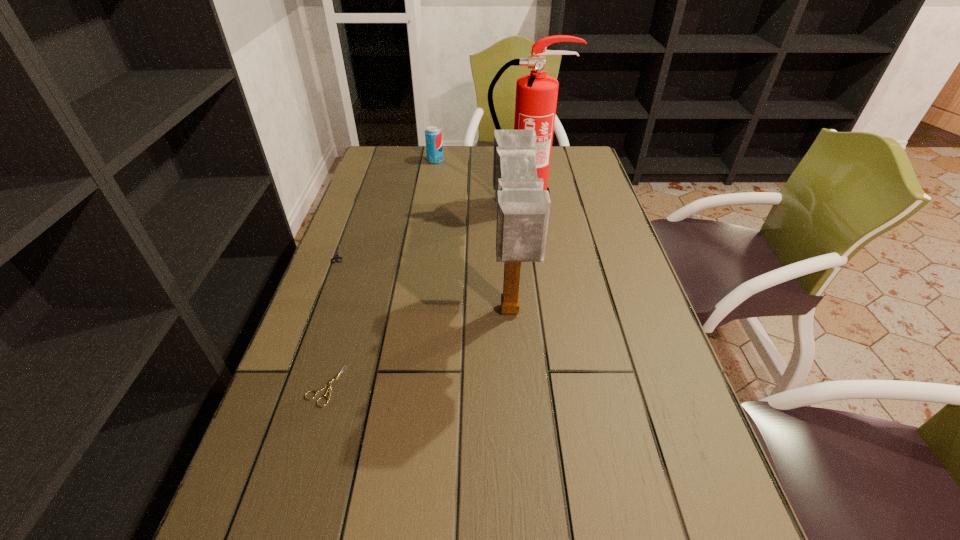
In the image, there is a desktop. Identify the location of vacant space at the far left corner. (375, 165).

In the image, there is a desktop. At what (x,y) coordinates should I click in order to perform the action: click on free region at the far right corner. Please return your answer as a coordinate pair (x, y). This screenshot has height=540, width=960. Looking at the image, I should click on (567, 150).

Identify the location of free space between the third farthest object and the nearer shears. The height and width of the screenshot is (540, 960). (332, 320).

The height and width of the screenshot is (540, 960). Find the location of `empty location between the third tallest object and the nearest object`. empty location between the third tallest object and the nearest object is located at coordinates (380, 273).

Identify the location of free space between the nearer shears and the left shears. The height and width of the screenshot is (540, 960). (332, 320).

Locate an element on the screen. The height and width of the screenshot is (540, 960). free space between the nearer shears and the farther shears is located at coordinates point(332,320).

This screenshot has width=960, height=540. In order to click on vacant space in between the second tallest object and the third nearest object in this screenshot , I will do `click(424, 282)`.

I want to click on empty space between the third shortest object and the third nearest object, so click(388, 207).

The image size is (960, 540). In order to click on free point between the right shears and the fire extinguisher in this screenshot , I will do `click(425, 294)`.

Identify the location of empty space between the nearest object and the farthest object. The image size is (960, 540). (380, 273).